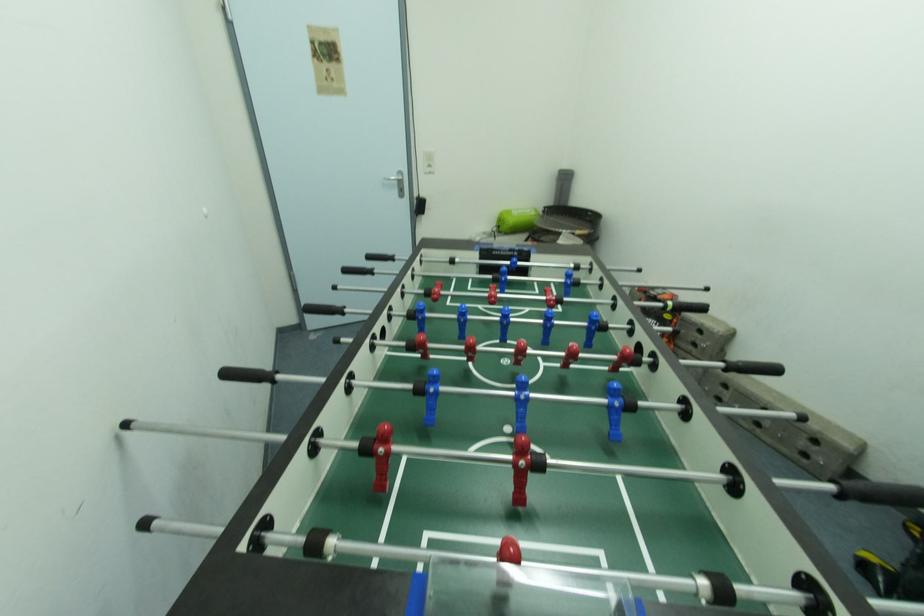
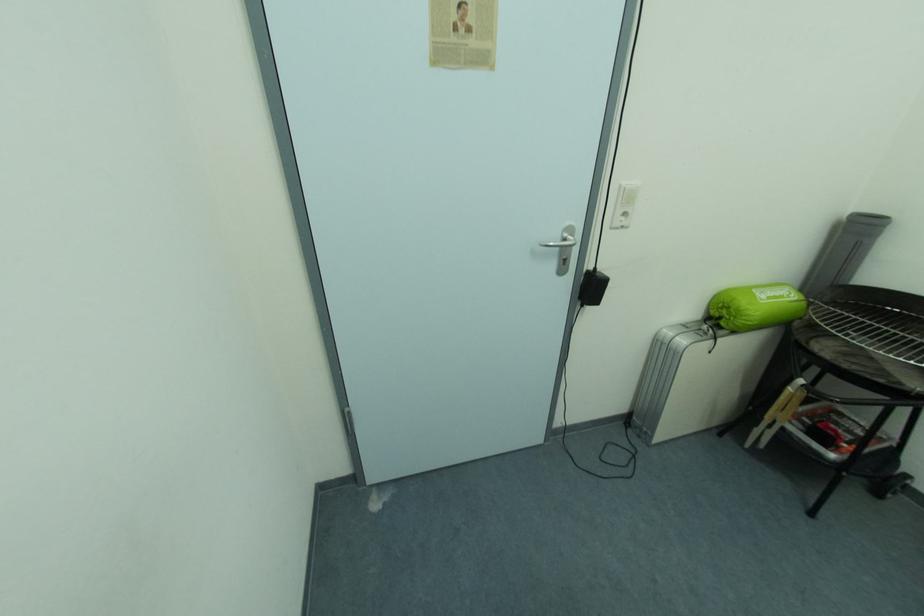
Consider the image. What movement of the cameraman would produce the second image?

The cameraman walked toward left, forward.